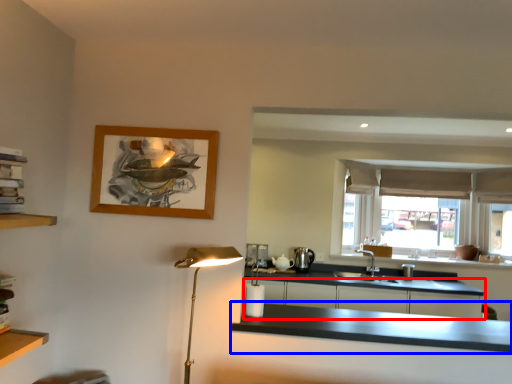
Question: Which object appears farthest to the camera in this image, cabinetry (highlighted by a red box) or countertop (highlighted by a blue box)?

Choices:
 (A) cabinetry
 (B) countertop

Answer: (A)